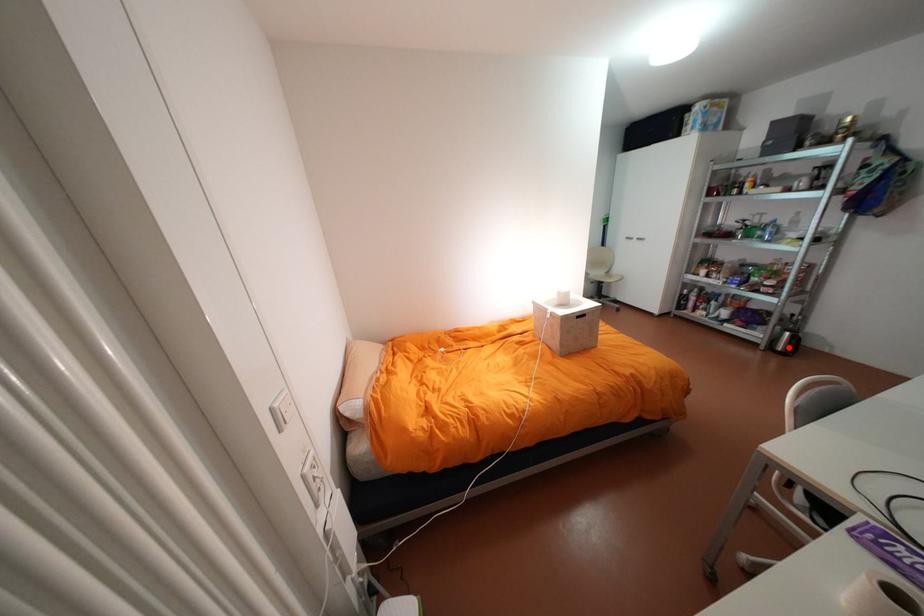
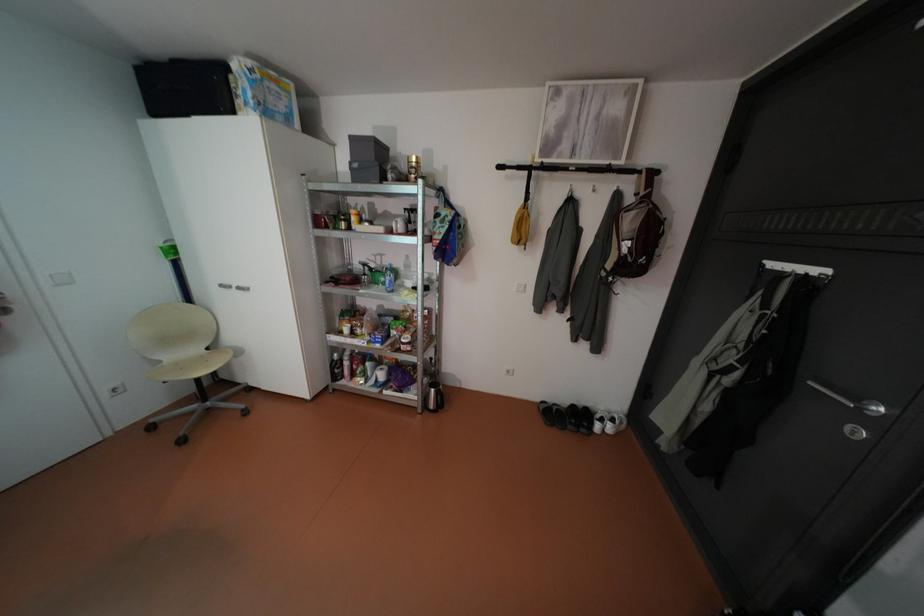
Find the pixel in the second image that matches the highlighted location in the first image.

(441, 405)